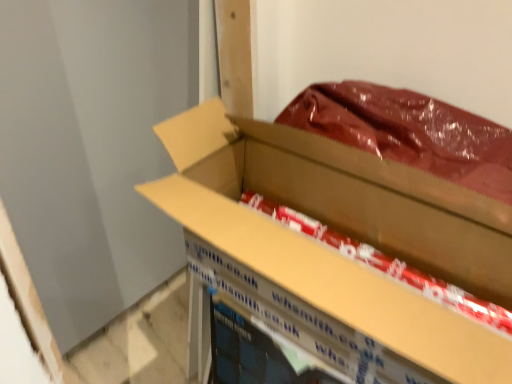
Question: Does cardboard box at center have a larger size compared to red glossy paper at center?

Choices:
 (A) no
 (B) yes

Answer: (B)

Question: Does cardboard box at center come in front of red glossy paper at center?

Choices:
 (A) no
 (B) yes

Answer: (B)

Question: Does cardboard box at center appear on the right side of red glossy paper at center?

Choices:
 (A) yes
 (B) no

Answer: (B)

Question: Are cardboard box at center and red glossy paper at center far apart?

Choices:
 (A) no
 (B) yes

Answer: (A)

Question: Is cardboard box at center positioned with its back to red glossy paper at center?

Choices:
 (A) yes
 (B) no

Answer: (A)

Question: Considering the relative positions of cardboard box at center and red glossy paper at center in the image provided, is cardboard box at center to the left of red glossy paper at center from the viewer's perspective?

Choices:
 (A) yes
 (B) no

Answer: (A)

Question: Is red glossy paper at center positioned far away from cardboard box at center?

Choices:
 (A) no
 (B) yes

Answer: (A)

Question: From the image's perspective, is red glossy paper at center located beneath cardboard box at center?

Choices:
 (A) yes
 (B) no

Answer: (B)

Question: Can you confirm if red glossy paper at center is taller than cardboard box at center?

Choices:
 (A) yes
 (B) no

Answer: (B)

Question: Is red glossy paper at center thinner than cardboard box at center?

Choices:
 (A) no
 (B) yes

Answer: (A)

Question: Is red glossy paper at center completely or partially outside of cardboard box at center?

Choices:
 (A) no
 (B) yes

Answer: (A)

Question: Can you confirm if red glossy paper at center is positioned to the left of cardboard box at center?

Choices:
 (A) no
 (B) yes

Answer: (A)

Question: In terms of width, does red glossy paper at center look wider or thinner when compared to cardboard box at center?

Choices:
 (A) wide
 (B) thin

Answer: (A)